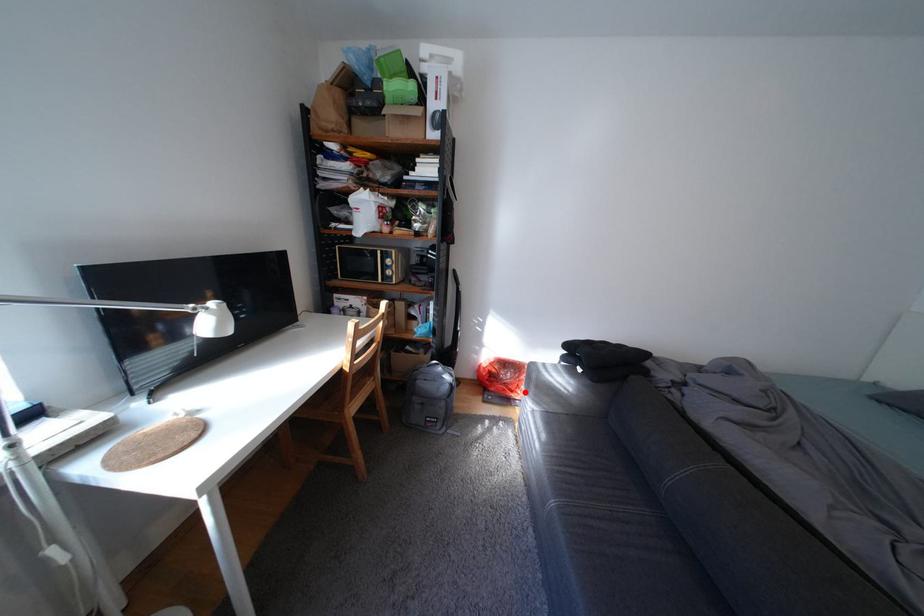
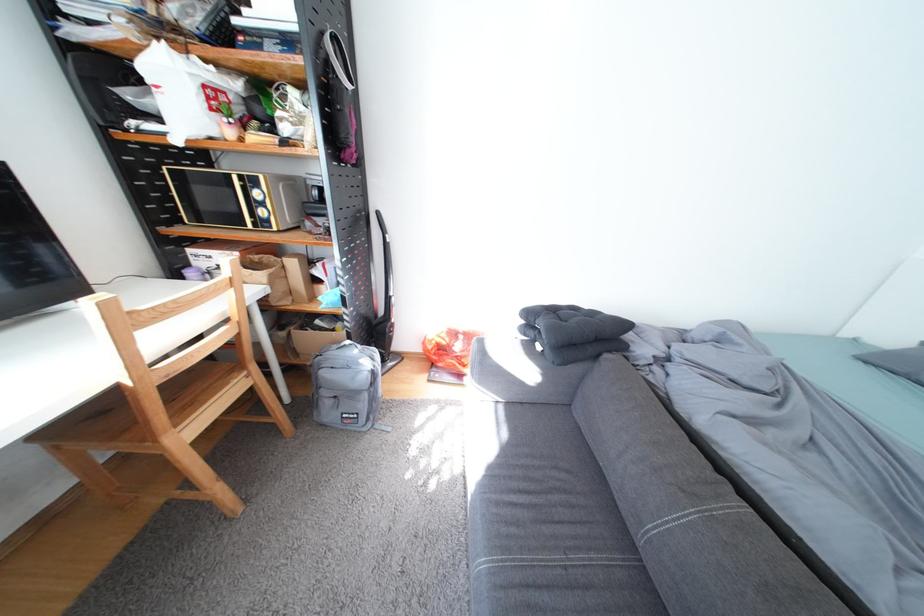
Locate, in the second image, the point that corresponds to the highlighted location in the first image.

(477, 367)